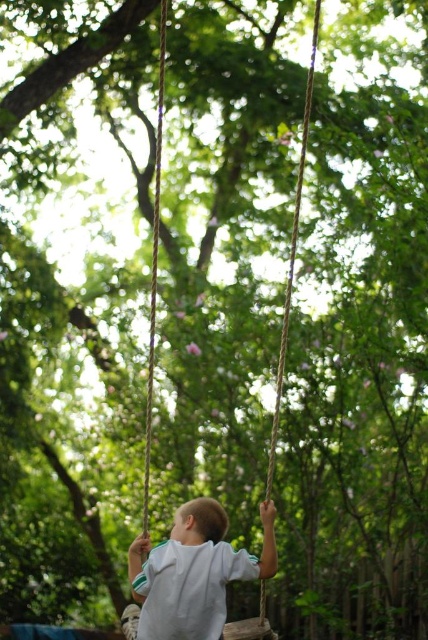
Measure the distance between point (267,548) and camera.

Point (267,548) is 4.49 meters from camera.

Locate an element on the screen. white cotton shirt at center is located at coordinates (193, 572).